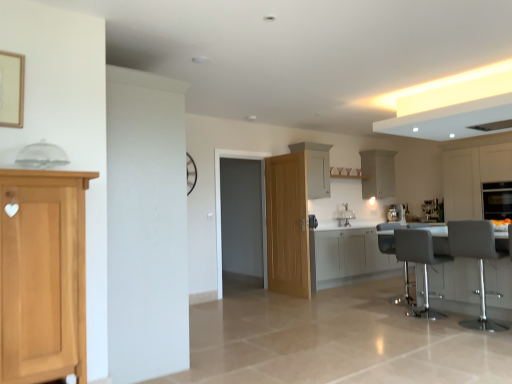
Question: From their relative heights in the image, would you say gray fabric swivel chair at lower right is taller or shorter than white glossy cabinets at center, which is the 2th cabinetry in front-to-back order?

Choices:
 (A) tall
 (B) short

Answer: (A)

Question: Based on their sizes in the image, would you say gray fabric swivel chair at lower right is bigger or smaller than white glossy cabinets at center, which appears as the 3th cabinetry when viewed from the left?

Choices:
 (A) small
 (B) big

Answer: (A)

Question: Based on their relative distances, which object is nearer to the white glossy cabinets at center, which appears as the 3th cabinetry when viewed from the left?

Choices:
 (A) white leather bar stool at right, arranged as the 2th chair when viewed from the front
 (B) white glossy exhaust hood at upper right
 (C) gray fabric swivel chair at lower right
 (D) white glossy sink at center
 (E) satin silver coffee machine at center, which ranks as the 1th coffee machine in left-to-right order

Answer: (D)

Question: Which object is positioned closest to the white glossy sink at center?

Choices:
 (A) white matte cabinet at center, acting as the second cabinetry starting from the left
 (B) gray fabric chair at right, the second chair positioned from the back
 (C) satin silver coffee machine at right, the first coffee machine when ordered from right to left
 (D) white matte cabinet at upper right, placed as the second cabinetry when sorted from right to left
 (E) metallic gray table at lower right

Answer: (A)